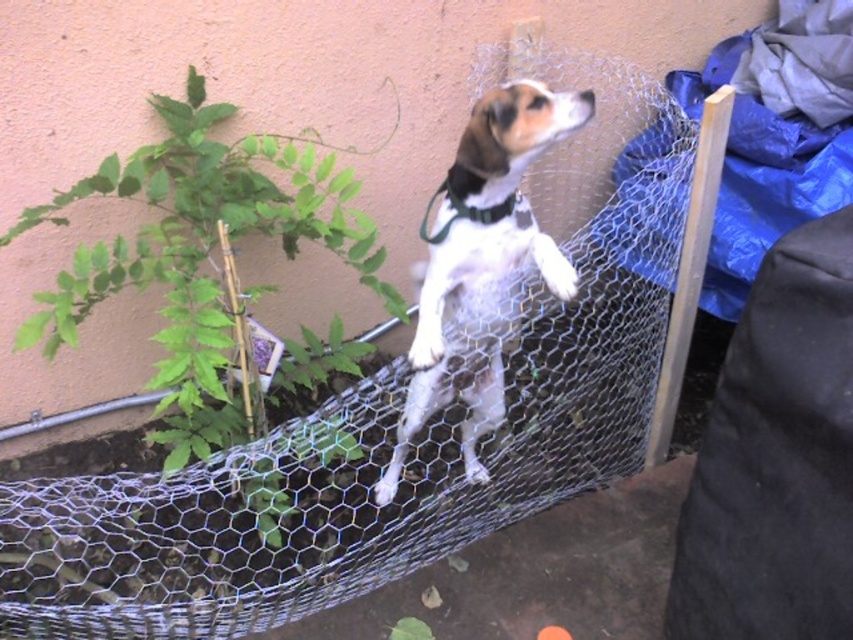
Does white fur dog at center appear under black fabric neckband at upper center?

Yes, white fur dog at center is below black fabric neckband at upper center.

Based on the photo, between white fur dog at center and black fabric neckband at upper center, which one is positioned lower?

Positioned lower is white fur dog at center.

Does point (471, 189) come behind point (465, 204)?

No.

Where is `white fur dog at center`? Image resolution: width=853 pixels, height=640 pixels. white fur dog at center is located at coordinates (482, 262).

Looking at this image, can you confirm if green leafy plant at upper left is taller than black fabric neckband at upper center?

Yes.

Which is behind, point (198, 228) or point (456, 205)?

Positioned behind is point (198, 228).

Does point (215, 387) come in front of point (508, 196)?

Yes, point (215, 387) is closer to viewer.

Image resolution: width=853 pixels, height=640 pixels. I want to click on green leafy plant at upper left, so click(198, 246).

Who is more forward, [172,211] or [527,136]?

Point [527,136] is more forward.

Who is more forward, (x=157, y=173) or (x=509, y=202)?

Point (x=509, y=202) is in front.

This screenshot has width=853, height=640. What are the coordinates of `green leafy plant at upper left` in the screenshot? It's located at (198, 246).